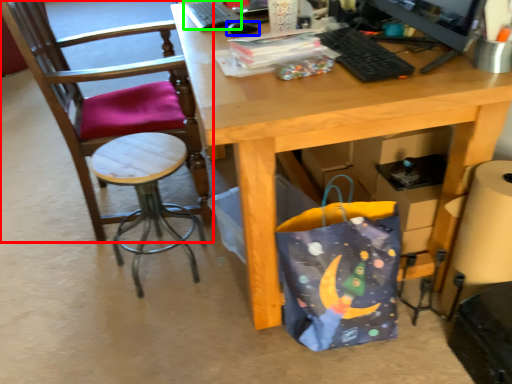
Question: Estimate the real-world distances between objects in this image. Which object is farther from chair (highlighted by a red box), mouse (highlighted by a blue box) or laptop keyboard (highlighted by a green box)?

Choices:
 (A) mouse
 (B) laptop keyboard

Answer: (A)